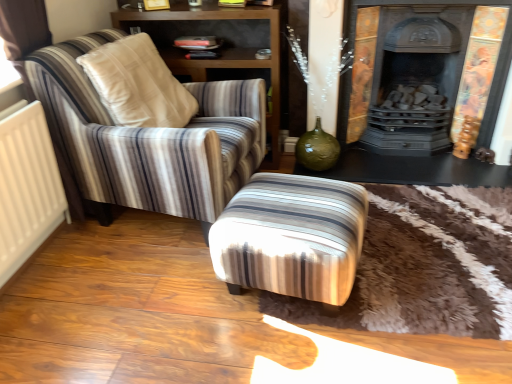
You are a GUI agent. You are given a task and a screenshot of the screen. Output one action in this format:
    pyautogui.click(x=<x>, y=<y>)
    Task: Click on the vacant space in between striped fabric ottoman at center and black glossy table at lower right
    This screenshot has height=384, width=512.
    Given the screenshot: What is the action you would take?
    pyautogui.click(x=421, y=225)